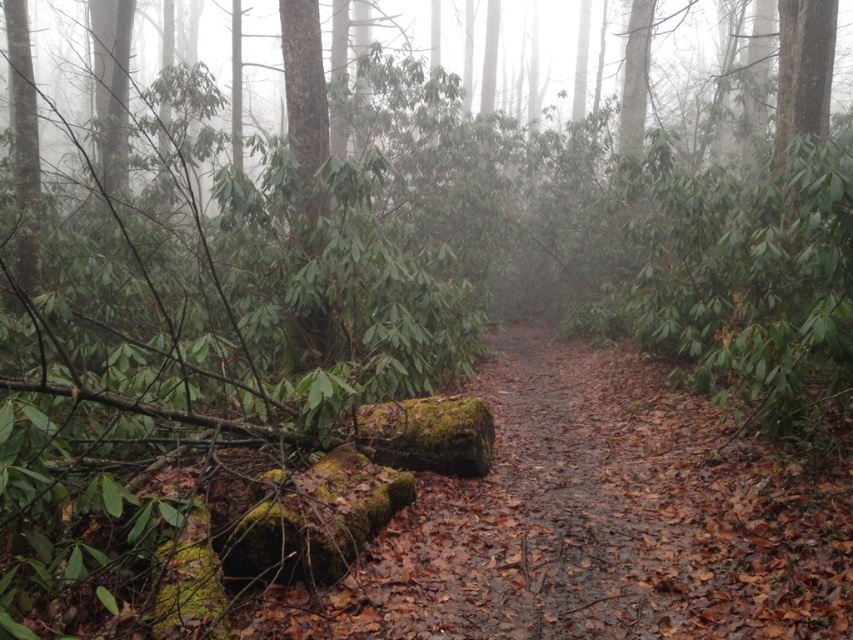
Question: Is green mossy tree trunk at center to the left of green mossy log at left from the viewer's perspective?

Choices:
 (A) yes
 (B) no

Answer: (B)

Question: Does green mossy tree trunk at center appear under green mossy log at left?

Choices:
 (A) yes
 (B) no

Answer: (A)

Question: Is green mossy tree trunk at center in front of green mossy log at left?

Choices:
 (A) yes
 (B) no

Answer: (A)